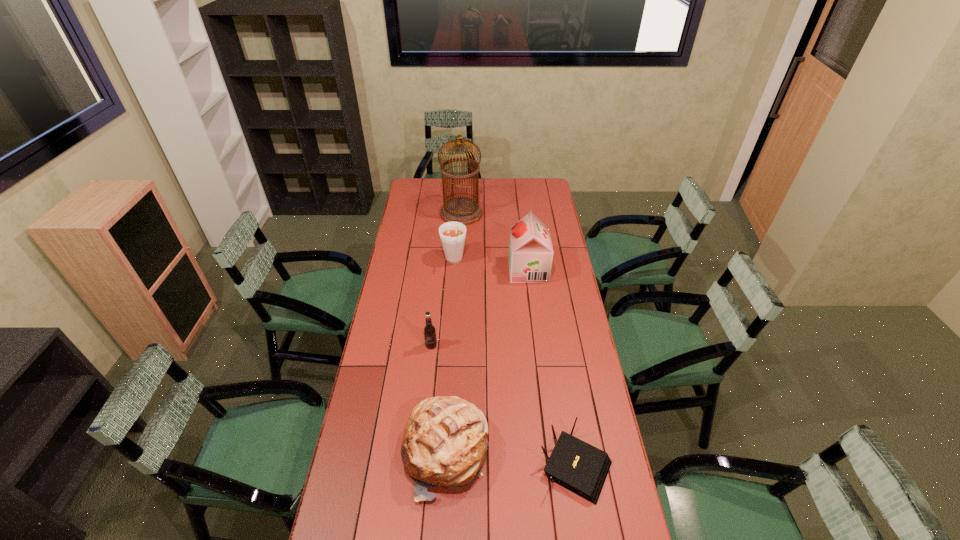
The height and width of the screenshot is (540, 960). Find the location of `free location that satisfies the following two spatial constraints: 1. on the front-facing side of the farthest object; 2. on the label of the shorter root beer`. free location that satisfies the following two spatial constraints: 1. on the front-facing side of the farthest object; 2. on the label of the shorter root beer is located at coordinates (454, 346).

Image resolution: width=960 pixels, height=540 pixels. Find the location of `vacant area that satisfies the following two spatial constraints: 1. on the drink side of the shortest object; 2. on the left side of the fourth shortest object`. vacant area that satisfies the following two spatial constraints: 1. on the drink side of the shortest object; 2. on the left side of the fourth shortest object is located at coordinates (440, 465).

The image size is (960, 540). Find the location of `vacant space that satisfies the following two spatial constraints: 1. on the front-facing side of the birdcage; 2. on the label of the third nearest object`. vacant space that satisfies the following two spatial constraints: 1. on the front-facing side of the birdcage; 2. on the label of the third nearest object is located at coordinates (454, 346).

At what (x,y) coordinates should I click in order to perform the action: click on vacant area in the image that satisfies the following two spatial constraints: 1. on the back side of the router; 2. on the front-facing side of the farthest object. Please return your answer as a coordinate pair (x, y). This screenshot has width=960, height=540. Looking at the image, I should click on (535, 213).

I want to click on vacant space that satisfies the following two spatial constraints: 1. on the label of the bread; 2. on the left side of the third nearest object, so click(420, 453).